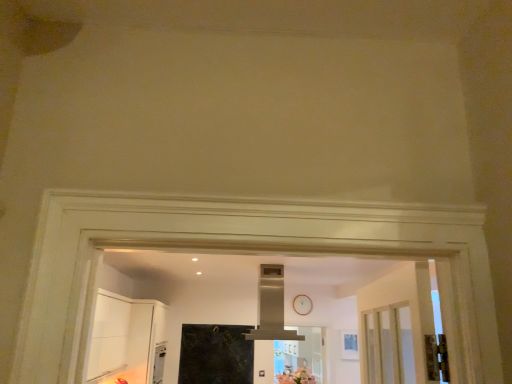
What is the approximate width of satin silver exhaust hood at center?

The width of satin silver exhaust hood at center is 24.58 inches.

This screenshot has height=384, width=512. I want to click on satin silver exhaust hood at center, so click(x=271, y=307).

Describe the element at coordinates (271, 307) in the screenshot. I see `satin silver exhaust hood at center` at that location.

Locate an element on the screen. Image resolution: width=512 pixels, height=384 pixels. pink matte flower at center is located at coordinates (296, 377).

What do you see at coordinates (296, 377) in the screenshot?
I see `pink matte flower at center` at bounding box center [296, 377].

This screenshot has height=384, width=512. I want to click on satin silver exhaust hood at center, so click(x=271, y=307).

Is satin silver exhaust hood at center to the left of pink matte flower at center from the viewer's perspective?

Yes, satin silver exhaust hood at center is to the left of pink matte flower at center.

Considering the relative positions of satin silver exhaust hood at center and pink matte flower at center in the image provided, is satin silver exhaust hood at center behind pink matte flower at center?

No, it is in front of pink matte flower at center.

Is point (271, 293) less distant than point (298, 368)?

Yes, point (271, 293) is closer to viewer.

In the scene shown: From the image's perspective, which one is positioned higher, satin silver exhaust hood at center or pink matte flower at center?

satin silver exhaust hood at center, from the image's perspective.

From a real-world perspective, which object stands above the other?

satin silver exhaust hood at center is physically above.

Considering the relative sizes of satin silver exhaust hood at center and pink matte flower at center in the image provided, is satin silver exhaust hood at center thinner than pink matte flower at center?

No, satin silver exhaust hood at center is not thinner than pink matte flower at center.

Which of these two, satin silver exhaust hood at center or pink matte flower at center, stands taller?

satin silver exhaust hood at center is taller.

Consider the image. Is satin silver exhaust hood at center bigger than pink matte flower at center?

Yes, satin silver exhaust hood at center is bigger than pink matte flower at center.

Is satin silver exhaust hood at center situated inside pink matte flower at center or outside?

The correct answer is: outside.

Are satin silver exhaust hood at center and pink matte flower at center making contact?

satin silver exhaust hood at center and pink matte flower at center are clearly separated.

Is satin silver exhaust hood at center facing towards pink matte flower at center?

No, satin silver exhaust hood at center is not oriented towards pink matte flower at center.

Locate an element on the screen. This screenshot has width=512, height=384. exhaust hood above the pink matte flower at center (from a real-world perspective) is located at coordinates (271, 307).

Between pink matte flower at center and satin silver exhaust hood at center, which one appears on the left side from the viewer's perspective?

satin silver exhaust hood at center.

Is pink matte flower at center positioned behind satin silver exhaust hood at center?

Yes, it is behind satin silver exhaust hood at center.

Considering the points (278, 375) and (283, 274), which point is behind, point (278, 375) or point (283, 274)?

Point (283, 274)

From the image's perspective, does pink matte flower at center appear higher than satin silver exhaust hood at center?

Incorrect, from the image's perspective, pink matte flower at center is lower than satin silver exhaust hood at center.

From a real-world perspective, which is physically below, pink matte flower at center or satin silver exhaust hood at center?

pink matte flower at center, from a real-world perspective.

Consider the image. Can you confirm if pink matte flower at center is wider than satin silver exhaust hood at center?

No, pink matte flower at center is not wider than satin silver exhaust hood at center.

In terms of height, does pink matte flower at center look taller or shorter compared to satin silver exhaust hood at center?

Considering their sizes, pink matte flower at center has less height than satin silver exhaust hood at center.

Does pink matte flower at center have a larger size compared to satin silver exhaust hood at center?

No.

Could satin silver exhaust hood at center be considered to be inside pink matte flower at center?

That's incorrect, satin silver exhaust hood at center is not inside pink matte flower at center.

Consider the image. Is pink matte flower at center placed right next to satin silver exhaust hood at center?

→ No, pink matte flower at center is not next to satin silver exhaust hood at center.

Is pink matte flower at center positioned with its back to satin silver exhaust hood at center?

That's not correct — pink matte flower at center is not looking away from satin silver exhaust hood at center.

Consider the image. What's the angular difference between pink matte flower at center and satin silver exhaust hood at center's facing directions?

There is a 0.903-degree angle between the facing directions of pink matte flower at center and satin silver exhaust hood at center.

Measure the distance from pink matte flower at center to satin silver exhaust hood at center.

pink matte flower at center is 28.57 inches away from satin silver exhaust hood at center.

I want to click on exhaust hood above the pink matte flower at center (from the image's perspective), so 271,307.

The height and width of the screenshot is (384, 512). I want to click on flower below the satin silver exhaust hood at center (from a real-world perspective), so click(296, 377).

Locate an element on the screen. This screenshot has width=512, height=384. flower on the right of the satin silver exhaust hood at center is located at coordinates (296, 377).